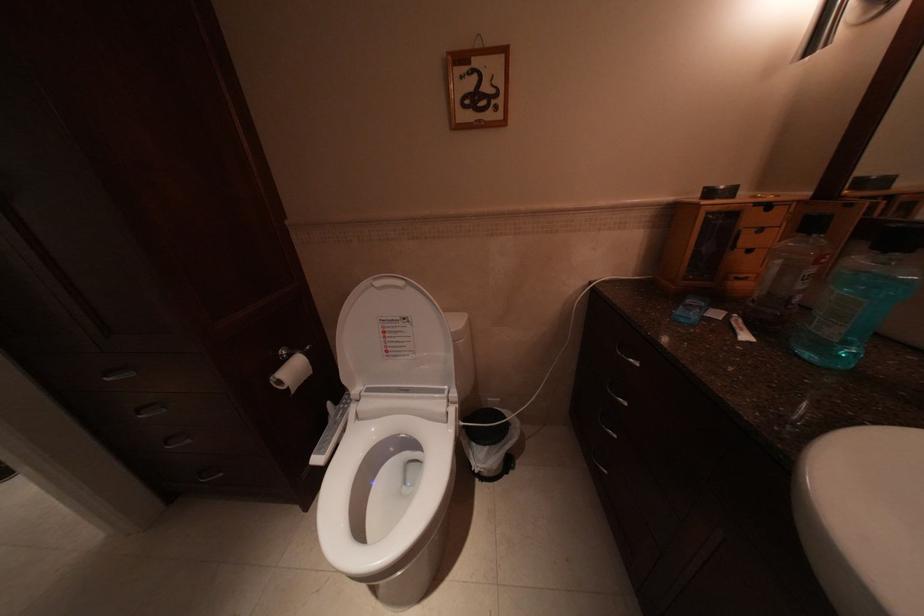
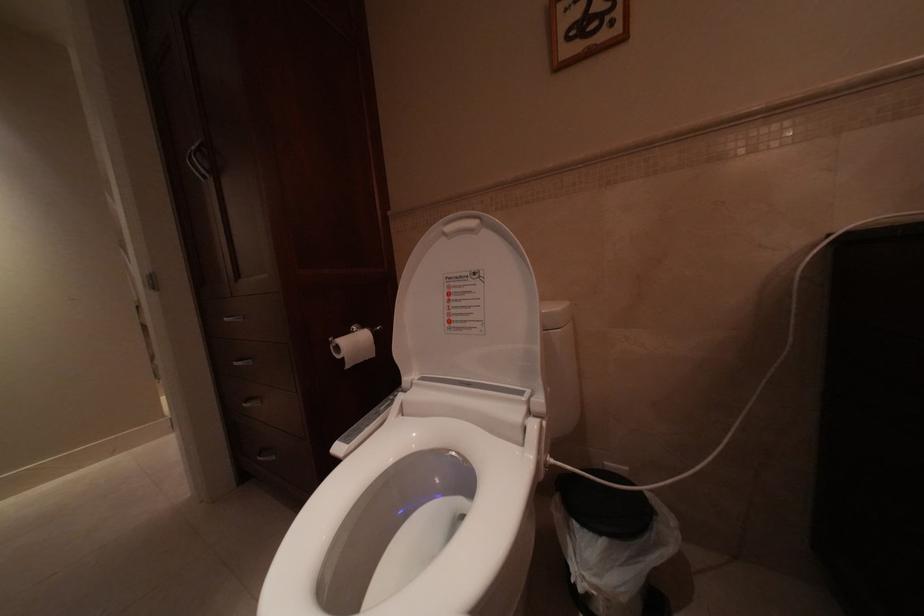
Based on the continuous images, in which direction is the camera rotating?

The camera rotated toward left-up.